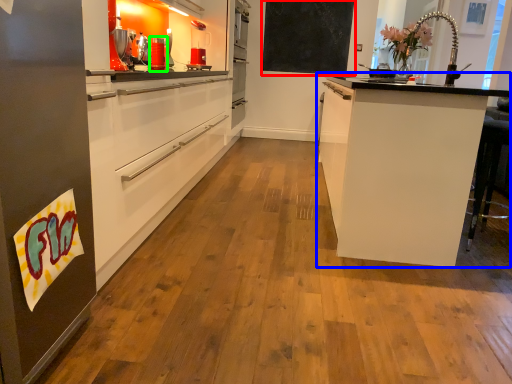
Question: Considering the real-world distances, which object is farthest from bulletin board (highlighted by a red box)? cabinetry (highlighted by a blue box) or appliance (highlighted by a green box)?

Choices:
 (A) cabinetry
 (B) appliance

Answer: (A)